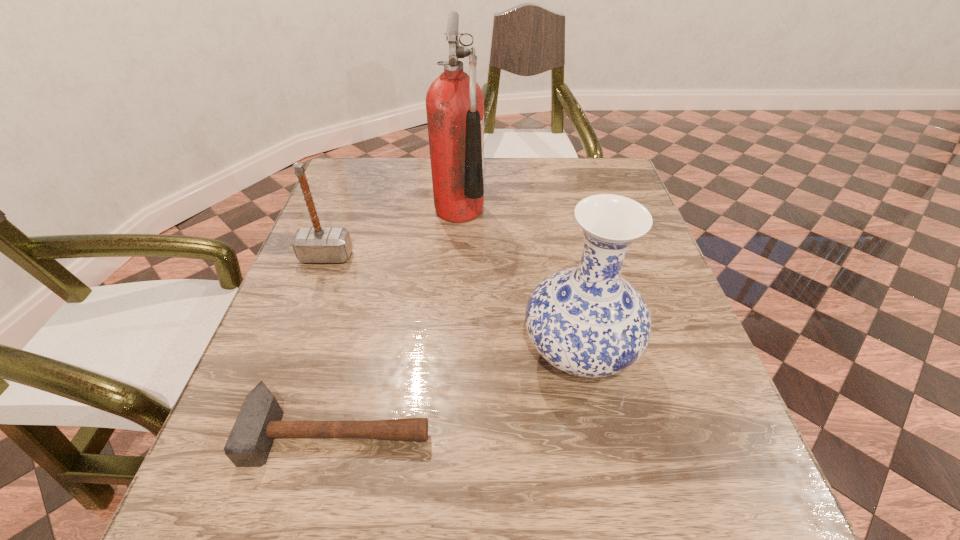
Where is `vacant space that is in between the farthest object and the rightmost object`? The height and width of the screenshot is (540, 960). vacant space that is in between the farthest object and the rightmost object is located at coordinates (518, 281).

Image resolution: width=960 pixels, height=540 pixels. In order to click on vacant area between the shorter hammer and the farther hammer in this screenshot , I will do `click(332, 343)`.

Where is `vacant area between the second tallest object and the shortest object`? vacant area between the second tallest object and the shortest object is located at coordinates (458, 392).

I want to click on vacant space that's between the farther hammer and the tallest object, so click(x=393, y=233).

You are a GUI agent. You are given a task and a screenshot of the screen. Output one action in this format:
    pyautogui.click(x=<x>, y=<y>)
    Task: Click on the unoccupied position between the fire extinguisher and the farther hammer
    
    Given the screenshot: What is the action you would take?
    pyautogui.click(x=393, y=233)

Locate an element on the screen. vacant point located between the vase and the tallest object is located at coordinates (518, 281).

Where is `free space between the shorter hammer and the fire extinguisher`? This screenshot has width=960, height=540. free space between the shorter hammer and the fire extinguisher is located at coordinates (398, 320).

Locate an element on the screen. This screenshot has width=960, height=540. empty space that is in between the farther hammer and the shortest object is located at coordinates (332, 343).

Locate which object is the closest to the third shortest object. Please provide its 2D coordinates. Your answer should be formatted as a tuple, i.e. [(x, y)], where the tuple contains the x and y coordinates of a point satisfying the conditions above.

[(258, 423)]

Select which object appears as the second closest to the vase. Please provide its 2D coordinates. Your answer should be formatted as a tuple, i.e. [(x, y)], where the tuple contains the x and y coordinates of a point satisfying the conditions above.

[(454, 102)]